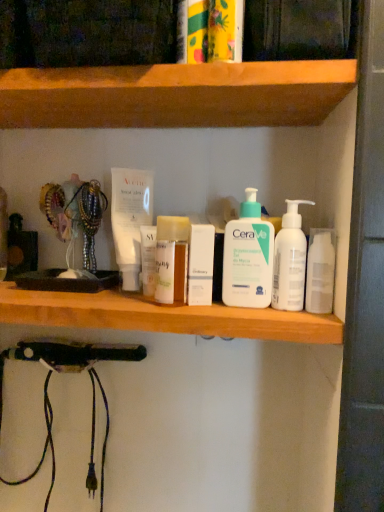
What do you see at coordinates (320, 272) in the screenshot? I see `white glossy mouthwash at right` at bounding box center [320, 272].

Describe the element at coordinates (290, 260) in the screenshot. The height and width of the screenshot is (512, 384). I see `white pump bottle at center, which is counted as the 2th cleaning product, starting from the left` at that location.

The image size is (384, 512). Describe the element at coordinates (176, 95) in the screenshot. I see `wooden at upper center, the second shelf in the bottom-to-top sequence` at that location.

You are a GUI agent. You are given a task and a screenshot of the screen. Output one action in this format:
    pyautogui.click(x=<x>, y=<y>)
    Task: Click on the white plastic bottles at center, arranged as the second shelf when viewed from the top
    This screenshot has height=512, width=384.
    Given the screenshot: What is the action you would take?
    pyautogui.click(x=162, y=316)

Find the location of a particular element. white matte pump bottle at center, which is the 1th cleaning product in left-to-right order is located at coordinates (248, 257).

Is white matte box at center facing away from white matte pump bottle at center, which is the 1th cleaning product in left-to-right order?

white matte box at center does not have its back to white matte pump bottle at center, which is the 1th cleaning product in left-to-right order.

Considering the positions of objects white matte box at center and white matte pump bottle at center, which is the second cleaning product from right to left, in the image provided, who is more to the right, white matte box at center or white matte pump bottle at center, which is the second cleaning product from right to left,?

From the viewer's perspective, white matte pump bottle at center, which is the second cleaning product from right to left, appears more on the right side.

In the scene shown: From the image's perspective, which is above, white matte box at center or white matte pump bottle at center, which is the second cleaning product from right to left?

From the image's view, white matte pump bottle at center, which is the second cleaning product from right to left, is above.

From a real-world perspective, is white matte box at center positioned above or below white matte pump bottle at center, which is the 1th cleaning product in left-to-right order?

white matte box at center is situated lower than white matte pump bottle at center, which is the 1th cleaning product in left-to-right order, in the real world.

Considering the positions of point (202, 263) and point (207, 331), is point (202, 263) closer or farther from the camera than point (207, 331)?

Point (202, 263).

Which shelf is the 1st one when counting from the front of the white matte box at center? Please provide its 2D coordinates.

[(162, 316)]

Is white matte box at center situated inside white plastic bottles at center, marked as the 1th shelf in a bottom-to-top arrangement, or outside?

white matte box at center exists outside the volume of white plastic bottles at center, marked as the 1th shelf in a bottom-to-top arrangement.

Is white matte box at center smaller than white plastic bottles at center, marked as the 1th shelf in a bottom-to-top arrangement?

Indeed, white matte box at center has a smaller size compared to white plastic bottles at center, marked as the 1th shelf in a bottom-to-top arrangement.

In terms of size, does white plastic bottles at center, marked as the 1th shelf in a bottom-to-top arrangement, appear bigger or smaller than white matte pump bottle at center, which is the second cleaning product from right to left?

Clearly, white plastic bottles at center, marked as the 1th shelf in a bottom-to-top arrangement, is larger in size than white matte pump bottle at center, which is the second cleaning product from right to left.

In terms of width, does white plastic bottles at center, marked as the 1th shelf in a bottom-to-top arrangement, look wider or thinner when compared to white matte pump bottle at center, which is the second cleaning product from right to left?

Considering their sizes, white plastic bottles at center, marked as the 1th shelf in a bottom-to-top arrangement, looks broader than white matte pump bottle at center, which is the second cleaning product from right to left.

Is point (300, 307) positioned after point (234, 291)?

That is False.

Is white matte pump bottle at center, which is the 1th cleaning product in left-to-right order, surrounded by white pump bottle at center, which is counted as the 2th cleaning product, starting from the left?

No, white matte pump bottle at center, which is the 1th cleaning product in left-to-right order, is not inside white pump bottle at center, which is counted as the 2th cleaning product, starting from the left.

Which of these two, white pump bottle at center, which is counted as the 2th cleaning product, starting from the left, or white matte pump bottle at center, which is the 1th cleaning product in left-to-right order, is bigger?

white matte pump bottle at center, which is the 1th cleaning product in left-to-right order, is bigger.

Does white matte pump bottle at center, which is the 1th cleaning product in left-to-right order, have a larger size compared to white plastic bottles at center, arranged as the second shelf when viewed from the top?

Actually, white matte pump bottle at center, which is the 1th cleaning product in left-to-right order, might be smaller than white plastic bottles at center, arranged as the second shelf when viewed from the top.

How different are the orientations of white matte pump bottle at center, which is the second cleaning product from right to left, and white plastic bottles at center, marked as the 1th shelf in a bottom-to-top arrangement, in degrees?

The angular difference between white matte pump bottle at center, which is the second cleaning product from right to left, and white plastic bottles at center, marked as the 1th shelf in a bottom-to-top arrangement, is 2.4 degrees.

From the image's perspective, which is below, white matte pump bottle at center, which is the second cleaning product from right to left, or white plastic bottles at center, marked as the 1th shelf in a bottom-to-top arrangement?

white plastic bottles at center, marked as the 1th shelf in a bottom-to-top arrangement, appears lower in the image.

Does point (224, 257) appear closer or farther from the camera than point (52, 326)?

Point (224, 257) is closer to the camera than point (52, 326).

Can you tell me how much wooden at upper center, the first shelf positioned from the top, and white pump bottle at center, which is the first cleaning product in right-to-left order, differ in facing direction?

The angular difference between wooden at upper center, the first shelf positioned from the top, and white pump bottle at center, which is the first cleaning product in right-to-left order, is 2.4 degrees.

From the image's perspective, between wooden at upper center, the first shelf positioned from the top, and white pump bottle at center, which is counted as the 2th cleaning product, starting from the left, who is located below?

From the image's view, white pump bottle at center, which is counted as the 2th cleaning product, starting from the left, is below.

From a real-world perspective, which is physically below, wooden at upper center, the second shelf in the bottom-to-top sequence, or white pump bottle at center, which is counted as the 2th cleaning product, starting from the left?

In real-world perspective, white pump bottle at center, which is counted as the 2th cleaning product, starting from the left, is lower.

The width and height of the screenshot is (384, 512). I want to click on shelf that appears above the white pump bottle at center, which is the first cleaning product in right-to-left order (from the image's perspective), so click(176, 95).

Which point is more distant from viewer, (28, 306) or (280, 264)?

The point (28, 306) is behind.

Considering the positions of objects white plastic bottles at center, marked as the 1th shelf in a bottom-to-top arrangement, and white pump bottle at center, which is the first cleaning product in right-to-left order, in the image provided, who is more to the right, white plastic bottles at center, marked as the 1th shelf in a bottom-to-top arrangement, or white pump bottle at center, which is the first cleaning product in right-to-left order,?

white pump bottle at center, which is the first cleaning product in right-to-left order.

Is white plastic bottles at center, marked as the 1th shelf in a bottom-to-top arrangement, further to the viewer compared to white pump bottle at center, which is counted as the 2th cleaning product, starting from the left?

No, white plastic bottles at center, marked as the 1th shelf in a bottom-to-top arrangement, is in front of white pump bottle at center, which is counted as the 2th cleaning product, starting from the left.

Where is `toiletry that appears behind the white matte pump bottle at center, which is the second cleaning product from right to left`? The width and height of the screenshot is (384, 512). toiletry that appears behind the white matte pump bottle at center, which is the second cleaning product from right to left is located at coordinates (201, 264).

Which shelf is the 2nd one when counting from the left side of the white matte box at center? Please provide its 2D coordinates.

[(162, 316)]

Considering their positions, is white glossy mouthwash at right positioned closer to white matte pump bottle at center, which is the 1th cleaning product in left-to-right order, than white pump bottle at center, which is the first cleaning product in right-to-left order?

white pump bottle at center, which is the first cleaning product in right-to-left order, is closer to white matte pump bottle at center, which is the 1th cleaning product in left-to-right order.

From the picture: From the image, which object appears to be farther from white matte box at center, white plastic bottles at center, marked as the 1th shelf in a bottom-to-top arrangement, or white pump bottle at center, which is counted as the 2th cleaning product, starting from the left?

Among the two, white plastic bottles at center, marked as the 1th shelf in a bottom-to-top arrangement, is located further to white matte box at center.

When comparing their distances from wooden at upper center, the second shelf in the bottom-to-top sequence, does white glossy mouthwash at right or white plastic bottles at center, marked as the 1th shelf in a bottom-to-top arrangement, seem closer?

white plastic bottles at center, marked as the 1th shelf in a bottom-to-top arrangement, lies closer to wooden at upper center, the second shelf in the bottom-to-top sequence, than the other object.

When comparing their distances from white plastic bottles at center, arranged as the second shelf when viewed from the top, does white pump bottle at center, which is the first cleaning product in right-to-left order, or white matte pump bottle at center, which is the 1th cleaning product in left-to-right order, seem further?

white pump bottle at center, which is the first cleaning product in right-to-left order, lies further to white plastic bottles at center, arranged as the second shelf when viewed from the top, than the other object.

Estimate the real-world distances between objects in this image. Which object is closer to white pump bottle at center, which is counted as the 2th cleaning product, starting from the left, white plastic bottles at center, marked as the 1th shelf in a bottom-to-top arrangement, or white glossy mouthwash at right?

Among the two, white glossy mouthwash at right is located nearer to white pump bottle at center, which is counted as the 2th cleaning product, starting from the left.

From the image, which object appears to be nearer to white glossy mouthwash at right, white matte box at center or white pump bottle at center, which is the first cleaning product in right-to-left order?

Among the two, white pump bottle at center, which is the first cleaning product in right-to-left order, is located nearer to white glossy mouthwash at right.

Looking at this image, which object lies further to the anchor point wooden at upper center, the second shelf in the bottom-to-top sequence, white plastic bottles at center, arranged as the second shelf when viewed from the top, or white glossy mouthwash at right?

white glossy mouthwash at right is positioned further to the anchor wooden at upper center, the second shelf in the bottom-to-top sequence.

Which object lies further to the anchor point white glossy mouthwash at right, white matte pump bottle at center, which is the second cleaning product from right to left, or wooden at upper center, the second shelf in the bottom-to-top sequence?

Based on the image, wooden at upper center, the second shelf in the bottom-to-top sequence, appears to be further to white glossy mouthwash at right.

Locate an element on the screen. The width and height of the screenshot is (384, 512). toiletry situated between white plastic bottles at center, arranged as the second shelf when viewed from the top, and white matte pump bottle at center, which is the second cleaning product from right to left, from left to right is located at coordinates (201, 264).

Identify the location of cleaning product located between white plastic bottles at center, marked as the 1th shelf in a bottom-to-top arrangement, and white pump bottle at center, which is the first cleaning product in right-to-left order, in the left-right direction. (248, 257).

Where is `cleaning product between white matte box at center and white pump bottle at center, which is counted as the 2th cleaning product, starting from the left, from left to right`? The height and width of the screenshot is (512, 384). cleaning product between white matte box at center and white pump bottle at center, which is counted as the 2th cleaning product, starting from the left, from left to right is located at coordinates 248,257.

Where is `toiletry between wooden at upper center, the second shelf in the bottom-to-top sequence, and white glossy mouthwash at right from top to bottom`? toiletry between wooden at upper center, the second shelf in the bottom-to-top sequence, and white glossy mouthwash at right from top to bottom is located at coordinates (201, 264).